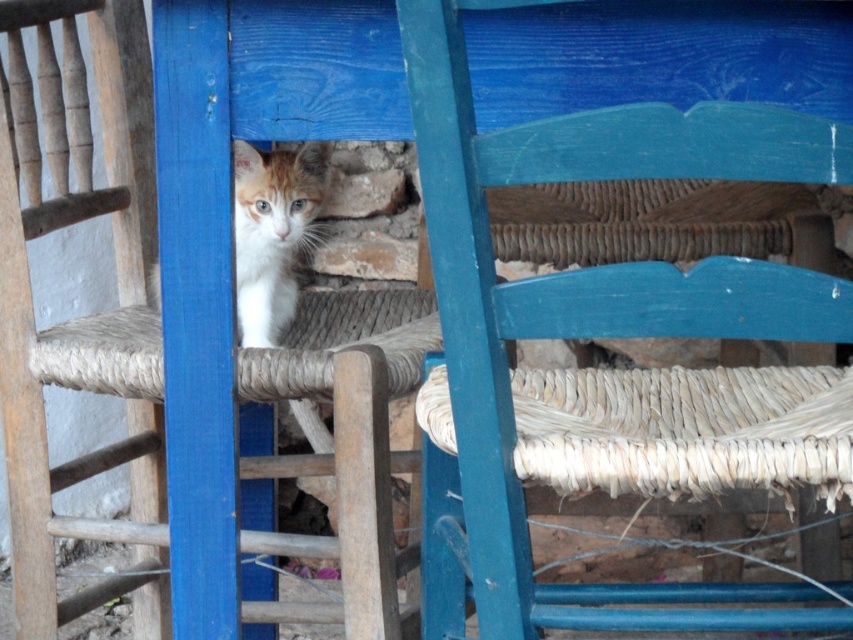
Question: Which object is farther from the camera taking this photo?

Choices:
 (A) rope-woven chair at center
 (B) orange-white fur kitten at center

Answer: (B)

Question: Which point is closer to the camera?

Choices:
 (A) rope-woven chair at center
 (B) orange-white fur kitten at center

Answer: (A)

Question: Observing the image, what is the correct spatial positioning of rope-woven chair at center in reference to orange-white fur kitten at center?

Choices:
 (A) above
 (B) below

Answer: (B)

Question: Can you confirm if rope-woven chair at center is positioned below orange-white fur kitten at center?

Choices:
 (A) no
 (B) yes

Answer: (B)

Question: Is rope-woven chair at center smaller than orange-white fur kitten at center?

Choices:
 (A) no
 (B) yes

Answer: (A)

Question: Which point is farther from the camera taking this photo?

Choices:
 (A) (28, 465)
 (B) (730, 116)
 (C) (267, 257)

Answer: (A)